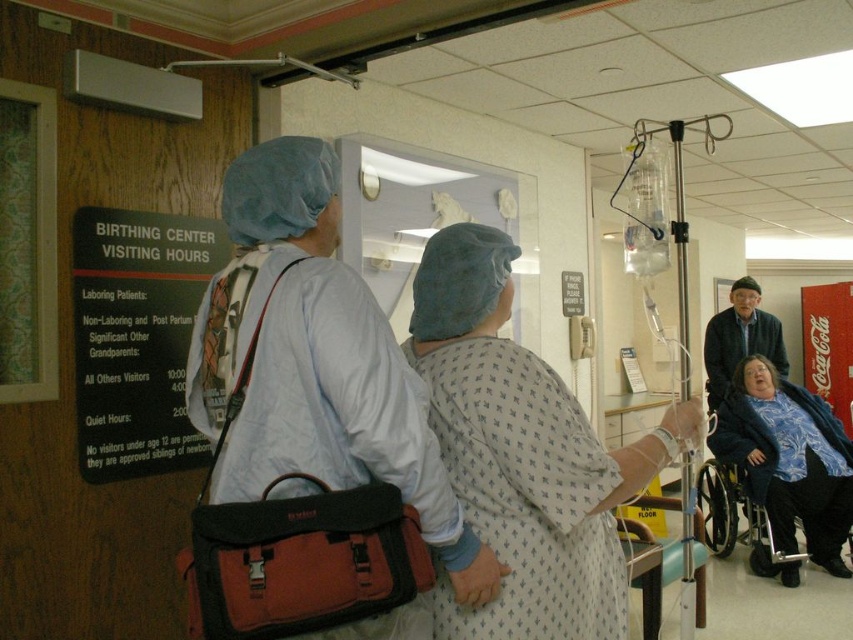
Question: Is patterned fabric gown at center bigger than clear plastic iv bag at center?

Choices:
 (A) yes
 (B) no

Answer: (B)

Question: Among these points, which one is nearest to the camera?

Choices:
 (A) (511, 442)
 (B) (265, 269)
 (C) (766, 356)
 (D) (683, 221)

Answer: (B)

Question: Which object is the farthest from the clear plastic iv bag at center?

Choices:
 (A) patterned fabric gown at center
 (B) black cardboard sign at left

Answer: (B)

Question: Estimate the real-world distances between objects in this image. Which object is closer to the black cardboard sign at left?

Choices:
 (A) patterned fabric gown at center
 (B) matte blue surgical cap at center
 (C) dark blue knit sweater at right
 (D) clear plastic iv bag at center

Answer: (B)

Question: Is matte blue surgical cap at center to the left of black cardboard sign at left from the viewer's perspective?

Choices:
 (A) no
 (B) yes

Answer: (A)

Question: Is matte blue surgical cap at center to the right of black cardboard sign at left from the viewer's perspective?

Choices:
 (A) no
 (B) yes

Answer: (B)